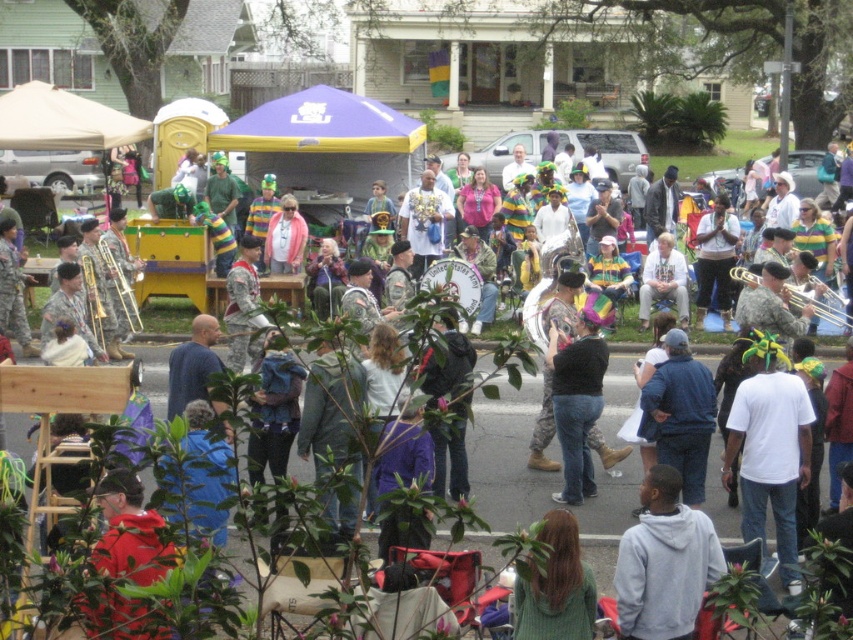
You are a photographer standing at the edge of the event. You want to take a photo that includes both the gray hoodie at lower center and the black matte shirt at center. What is the minimum distance you need to move backward to ensure both are in frame?

The gray hoodie at lower center is 15.19 feet from the black matte shirt at center. To include both in the frame, you need to move backward at least 15.19 feet to ensure the entire distance between them fits within the camera view.

You are a photographer trying to capture the musicians in the center of the scene. You need to know the position of the white cotton shirt at center relative to the black matte shirt at center to frame your shot. Which side should you focus on to include both shirts in the frame?

The white cotton shirt at center is to the right of the black matte shirt at center, so you should focus on the right side to include both shirts in the frame.